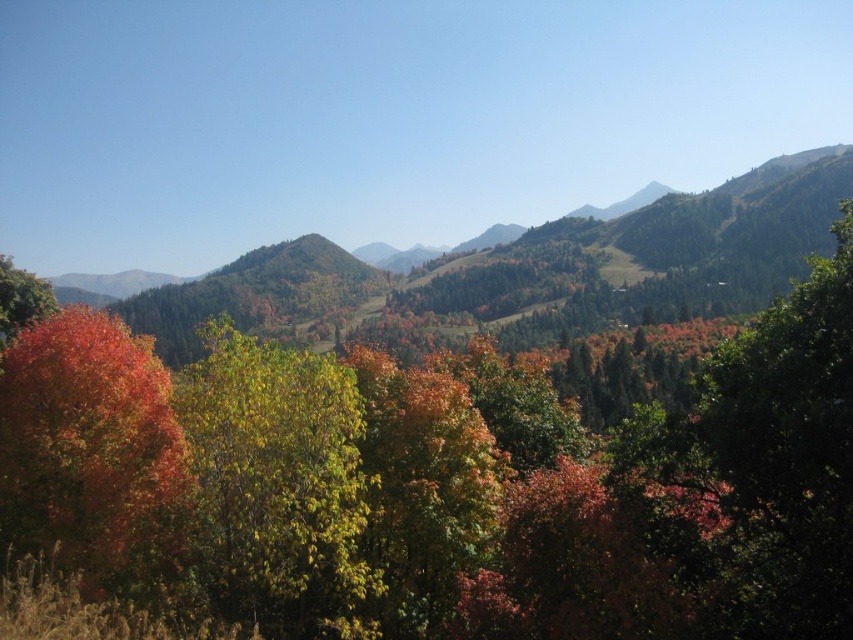
In the scene shown: Is green leafy tree at center below matte orange tree at left?

Correct, green leafy tree at center is located below matte orange tree at left.

Does point (206, 324) come farther from viewer compared to point (22, 324)?

No, it is not.

In order to click on green leafy tree at center in this screenshot , I will do `click(277, 484)`.

Is point (22, 348) positioned before point (3, 256)?

Yes, it is in front of point (3, 256).

Can you confirm if shiny red leaves at left is positioned to the left of matte orange tree at left?

In fact, shiny red leaves at left is to the right of matte orange tree at left.

Is point (80, 321) more distant than point (42, 289)?

No.

Identify the location of shiny red leaves at left. The image size is (853, 640). (93, 452).

Does point (256, 442) come farther from viewer compared to point (184, 520)?

No, (256, 442) is closer to viewer.

Who is more distant from viewer, [235,356] or [107,333]?

The point [107,333] is more distant.

Where is `green leafy tree at center`? This screenshot has width=853, height=640. green leafy tree at center is located at coordinates pyautogui.click(x=277, y=484).

I want to click on green leafy tree at center, so click(277, 484).